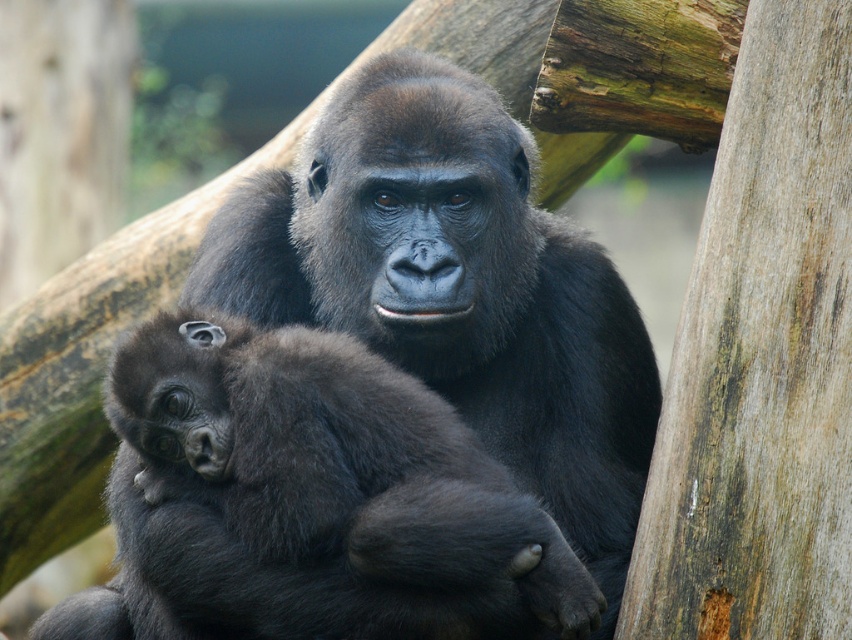
You are a wildlife photographer aiming to capture a close shot of the soft fur baby gorilla at center and the smooth brown wood at right. Which object is closer to your camera lens?

The soft fur baby gorilla at center is closer to the camera lens than the smooth brown wood at right because it is positioned further to the viewer.

You are a wildlife photographer aiming to capture the soft fur baby gorilla at center and the smooth brown wood at right in the same frame. Based on their sizes, which object should you focus on first to ensure both fit in the frame?

The soft fur baby gorilla at center is wider than the smooth brown wood at right, so you should focus on the soft fur baby gorilla at center first to ensure both fit in the frame.

You are a zookeeper observing the gorillas in their enclosure. You notice the soft fur baby gorilla at center and the smooth brown wood at right. Which object is taller?

The soft fur baby gorilla at center is shorter than the smooth brown wood at right, so the smooth brown wood at right is taller.